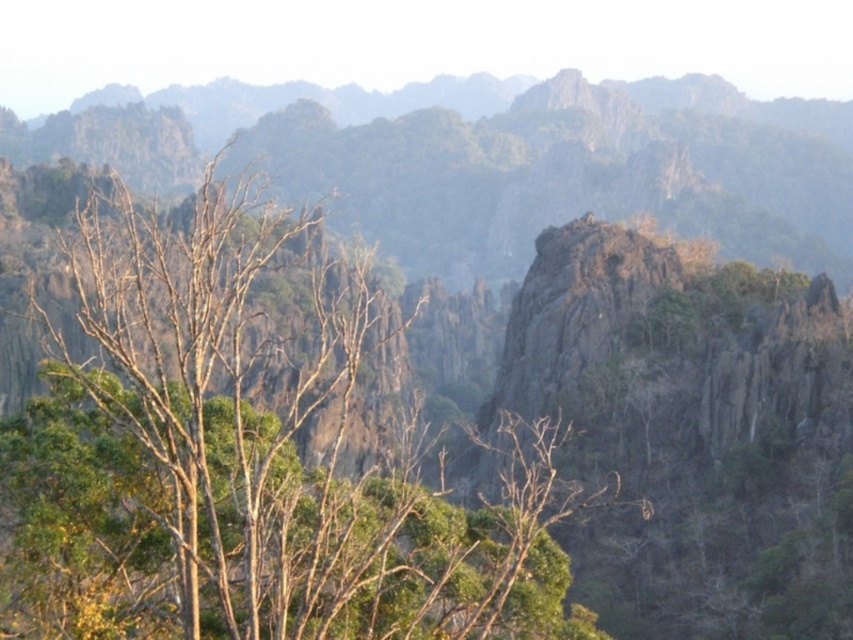
Question: Does green leafy tree at center appear on the left side of rough gray rock at center?

Choices:
 (A) yes
 (B) no

Answer: (A)

Question: Which point is closer to the camera?

Choices:
 (A) (759, 332)
 (B) (253, 208)

Answer: (B)

Question: Which is nearer to the rugged gray rock at center?

Choices:
 (A) rough gray rock at center
 (B) green leafy tree at center

Answer: (B)

Question: Considering the relative positions of green leafy tree at center and rough gray rock at center in the image provided, where is green leafy tree at center located with respect to rough gray rock at center?

Choices:
 (A) left
 (B) right

Answer: (A)

Question: Can you confirm if green leafy tree at center is positioned to the left of rough gray rock at center?

Choices:
 (A) yes
 (B) no

Answer: (A)

Question: Which object is the closest to the green leafy tree at center?

Choices:
 (A) rough gray rock at center
 (B) rugged gray rock at center

Answer: (A)